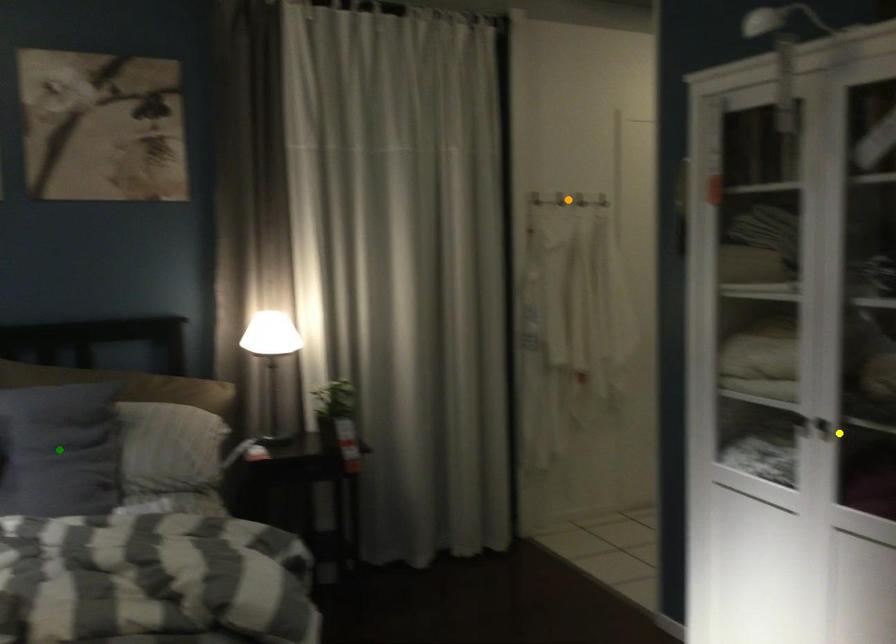
Order these from nearest to farthest:
orange point, yellow point, green point

1. yellow point
2. green point
3. orange point